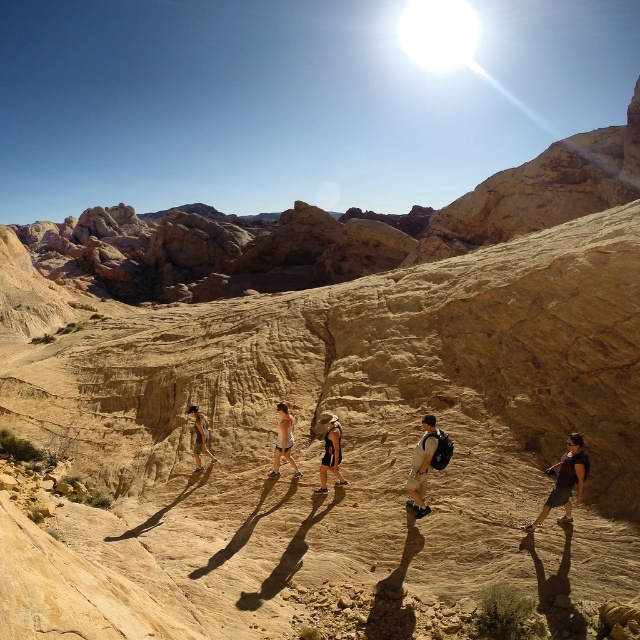
Question: Estimate the real-world distances between objects in this image. Which object is farther from the tan skin person at center?

Choices:
 (A) matte black shorts at center
 (B) orange and black tank top at center
 (C) light brown sandal at center
 (D) purple fabric shirt at right

Answer: (D)

Question: Is light brown sandal at center smaller than purple fabric shirt at right?

Choices:
 (A) yes
 (B) no

Answer: (B)

Question: Among these objects, which one is nearest to the camera?

Choices:
 (A) light brown sandal at center
 (B) tan skin person at center
 (C) orange and black tank top at center
 (D) matte black shorts at center

Answer: (A)

Question: Does purple fabric shirt at right have a lesser width compared to tan skin person at center?

Choices:
 (A) yes
 (B) no

Answer: (B)

Question: Can you confirm if orange and black tank top at center is positioned to the right of matte black shorts at center?

Choices:
 (A) yes
 (B) no

Answer: (A)

Question: Among these objects, which one is farthest from the camera?

Choices:
 (A) orange and black tank top at center
 (B) tan skin person at center
 (C) matte black shorts at center
 (D) light brown sandal at center

Answer: (C)